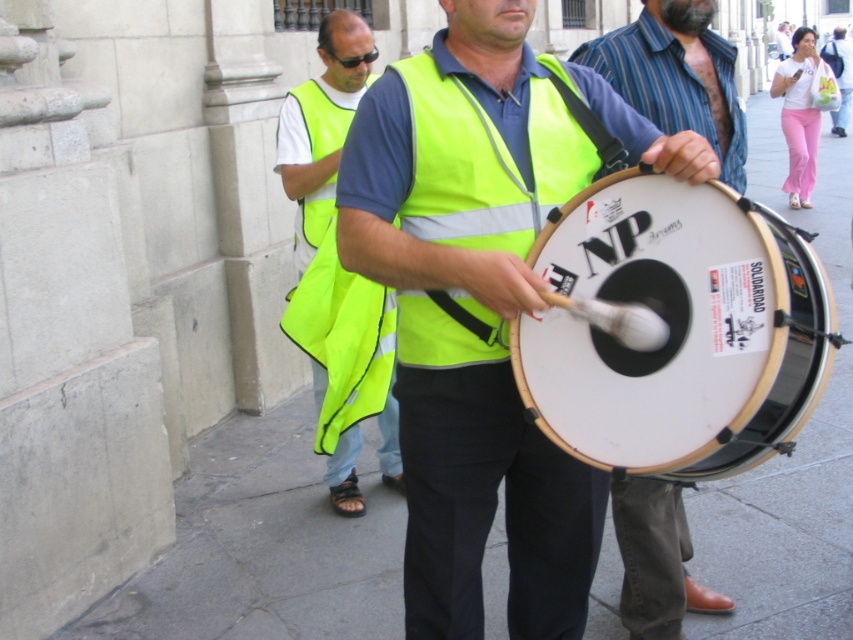
You are a photographer trying to capture both the yellow reflective vest at center and the white matte drum at center in a single frame. Based on their sizes, which object should you focus on first to ensure both fit in the photo?

The yellow reflective vest at center is bigger than the white matte drum at center, so you should focus on the yellow reflective vest at center first to ensure both fit in the photo.

You are a photographer standing at the edge of the street scene. You need to capture a photo that includes both the yellow reflective vest at center and the white matte drum at center. Based on their positions, which object should you focus on first to ensure both are in frame?

The white matte drum at center is behind the yellow reflective vest at center. To ensure both are in frame, focus on the yellow reflective vest at center first since it is closer to you, allowing the drum behind it to still be visible in the background.

You are a street performer who needs to decide which item to carry first. You see the white matte drum at center and the high visibility fabric safety vest at center. Which one should you pick up first if you want to carry the bigger item first?

The white matte drum at center is larger in size than the high visibility fabric safety vest at center, so you should pick up the white matte drum at center first.